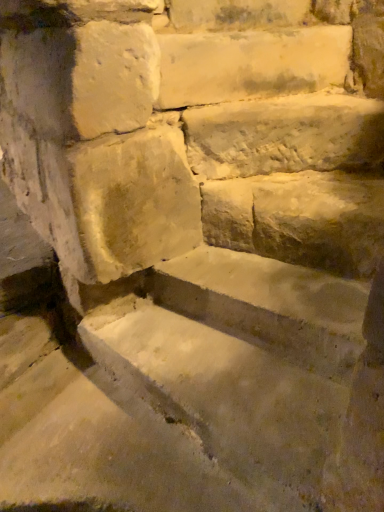
Question: From a real-world perspective, is white stone step at upper center, which ranks as the first limestone in top-to-bottom order, above or below smooth stone brick at upper center?

Choices:
 (A) above
 (B) below

Answer: (B)

Question: Looking at their shapes, would you say white stone step at upper center, the 2th limestone positioned from the bottom, is wider or thinner than smooth stone brick at upper center?

Choices:
 (A) thin
 (B) wide

Answer: (B)

Question: Which object is the farthest from the white stone step at upper center, the 2th limestone positioned from the bottom?

Choices:
 (A) smooth stone brick at upper center
 (B) white rough stone at center, which is the 2th limestone in top-to-bottom order

Answer: (B)

Question: Estimate the real-world distances between objects in this image. Which object is closer to the white stone step at upper center, which ranks as the first limestone in top-to-bottom order?

Choices:
 (A) white rough stone at center, acting as the 1th limestone starting from the bottom
 (B) smooth stone brick at upper center

Answer: (B)